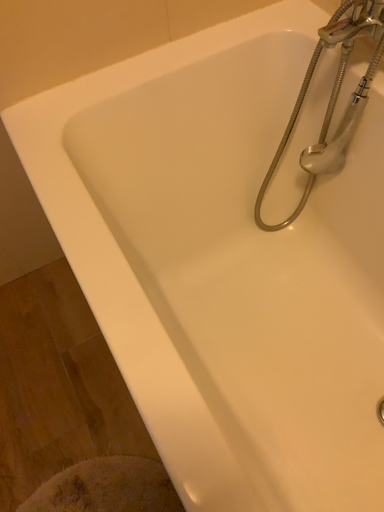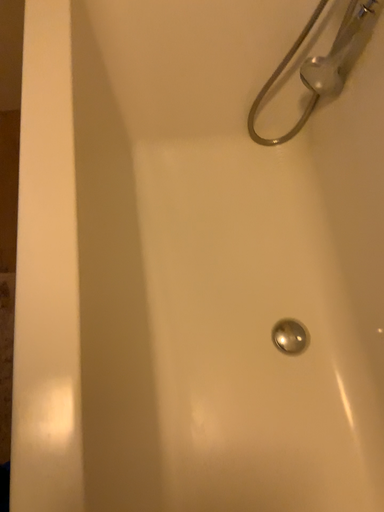
Question: Which way did the camera rotate in the video?

Choices:
 (A) rotated left
 (B) rotated right

Answer: (A)